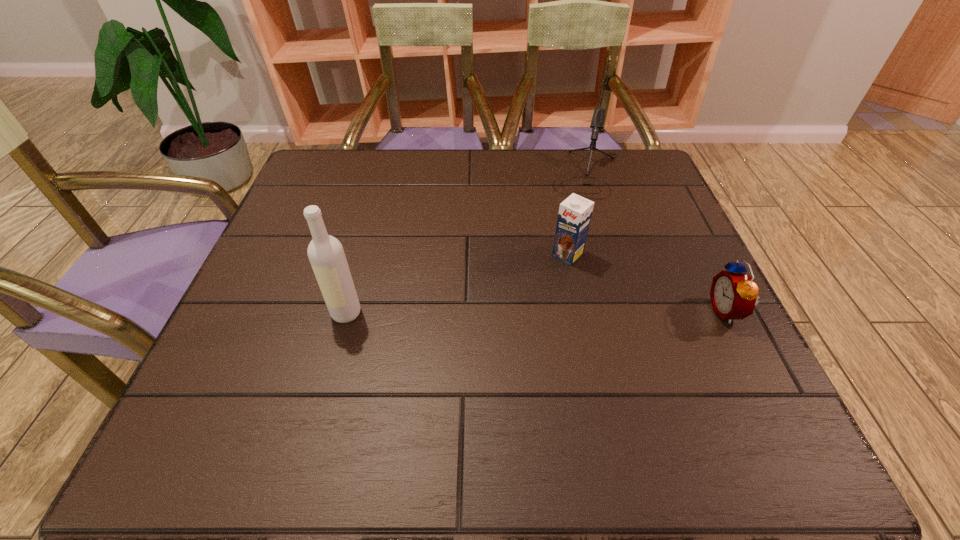
Locate an element on the screen. The height and width of the screenshot is (540, 960). vacant area in the image that satisfies the following two spatial constraints: 1. on the back side of the third nearest object; 2. on the right side of the farthest object is located at coordinates (551, 174).

Where is `vacant position in the image that satisfies the following two spatial constraints: 1. on the back side of the vodka; 2. on the front-facing side of the rightmost object`? The height and width of the screenshot is (540, 960). vacant position in the image that satisfies the following two spatial constraints: 1. on the back side of the vodka; 2. on the front-facing side of the rightmost object is located at coordinates (347, 311).